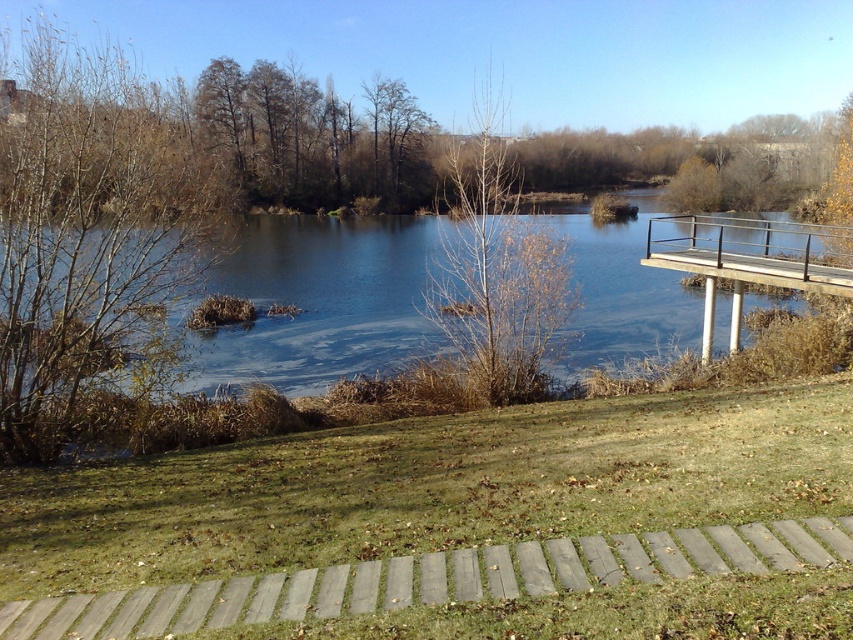
Question: Among these objects, which one is nearest to the camera?

Choices:
 (A) brown leafy tree at left
 (B) wooden planks at lower center
 (C) bare branches at center

Answer: (B)

Question: Does brown leafy tree at left appear over wooden planks at lower center?

Choices:
 (A) yes
 (B) no

Answer: (A)

Question: Which point is closer to the camera taking this photo?

Choices:
 (A) (540, 355)
 (B) (15, 186)
 (C) (491, 550)
 (D) (822, 237)

Answer: (C)

Question: Is blue water at center to the right of brown wooden bridge at right from the viewer's perspective?

Choices:
 (A) yes
 (B) no

Answer: (B)

Question: Estimate the real-world distances between objects in this image. Which object is closer to the brown wooden bridge at right?

Choices:
 (A) brown leafy tree at left
 (B) bare branches at center
 (C) blue water at center

Answer: (C)

Question: Observing the image, what is the correct spatial positioning of blue water at center in reference to brown wooden bridge at right?

Choices:
 (A) left
 (B) right

Answer: (A)